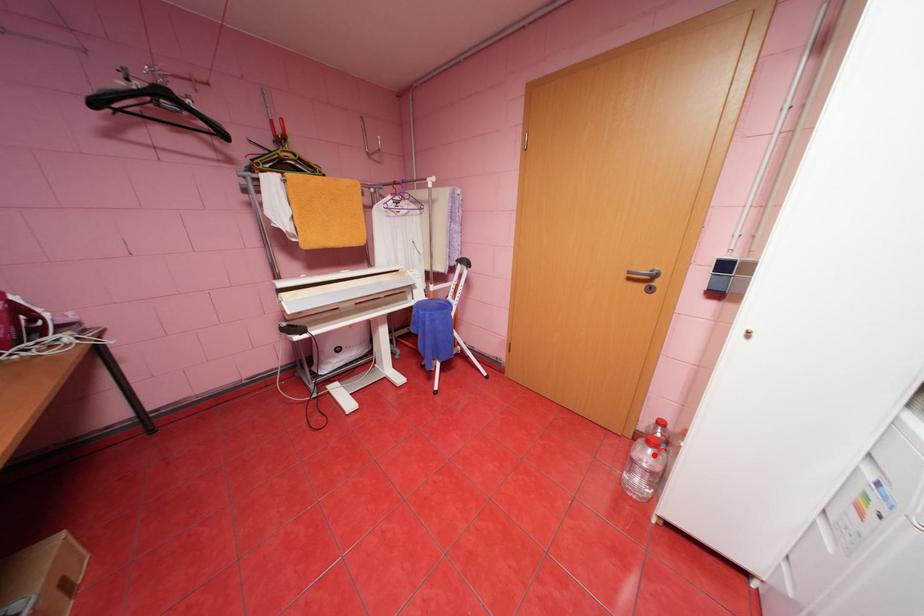
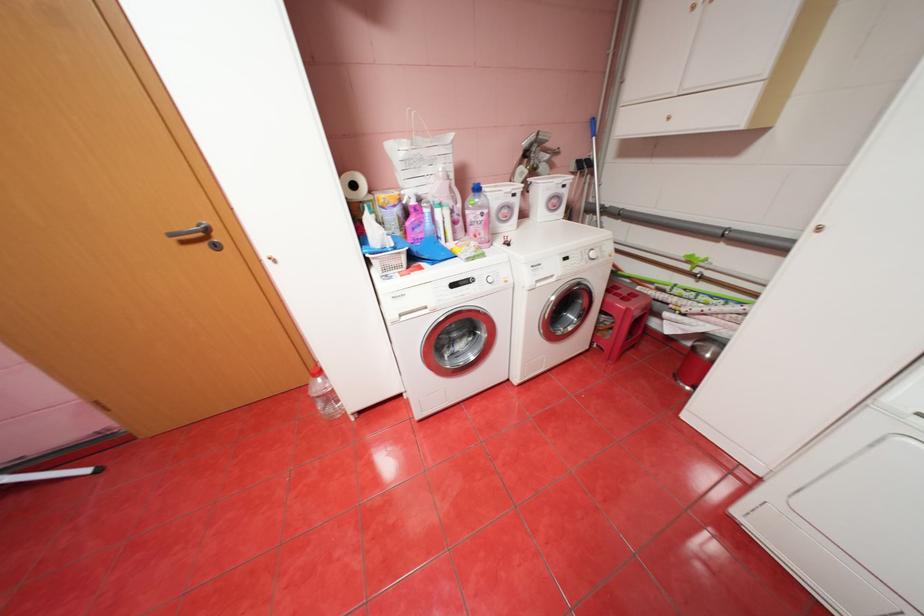
Question: A red point is marked in image1. In image2, is the corresponding 3D point closer to the camera or farther? Reply with the corresponding letter.

Choices:
 (A) The corresponding 3D point is closer.
 (B) The corresponding 3D point is farther.

Answer: (B)